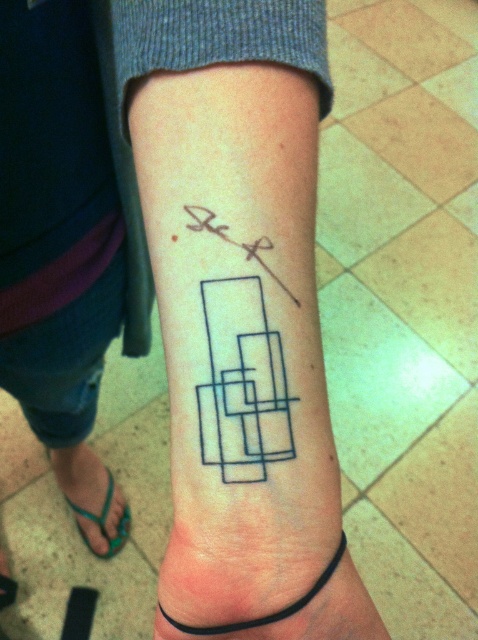
Question: Is the position of green rubber sandal at lower left less distant than that of black ink square at upper center?

Choices:
 (A) no
 (B) yes

Answer: (A)

Question: Which of the following is the farthest from the observer?

Choices:
 (A) black ink square at upper center
 (B) black rubber band at lower center
 (C) black ink tattoo at center
 (D) green rubber sandal at lower left

Answer: (D)

Question: Which point appears farthest from the camera in this image?

Choices:
 (A) (252, 70)
 (B) (108, 474)
 (C) (282, 621)
 (D) (186, 224)

Answer: (B)

Question: Where is black rubber band at lower center located in relation to green rubber sandal at lower left in the image?

Choices:
 (A) left
 (B) right

Answer: (B)

Question: Which object appears farthest from the camera in this image?

Choices:
 (A) black ink square at upper center
 (B) green rubber sandal at lower left
 (C) black ink tattoo at center

Answer: (B)

Question: From the image, what is the correct spatial relationship of green rubber sandal at lower left in relation to black ink square at upper center?

Choices:
 (A) left
 (B) right

Answer: (A)